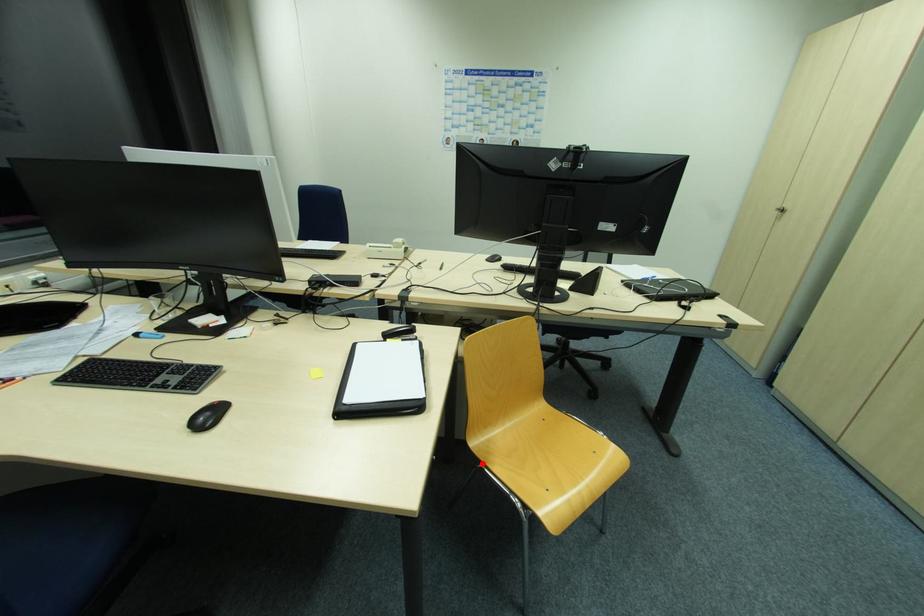
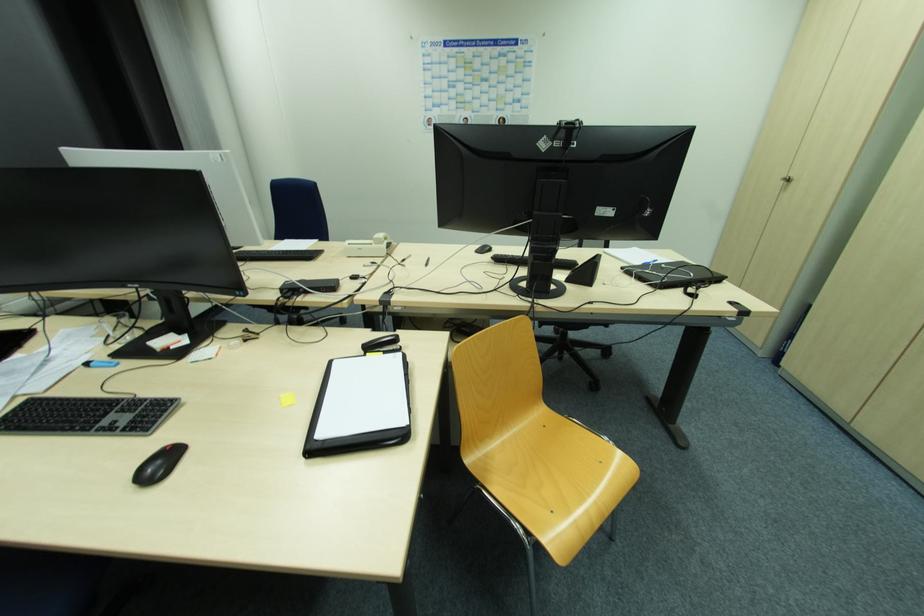
Question: I am providing you with two images of the same scene from different viewpoints. A red point is marked on the first image. Can you still see the location of the red point in image 2?

Choices:
 (A) Yes
 (B) No

Answer: (A)